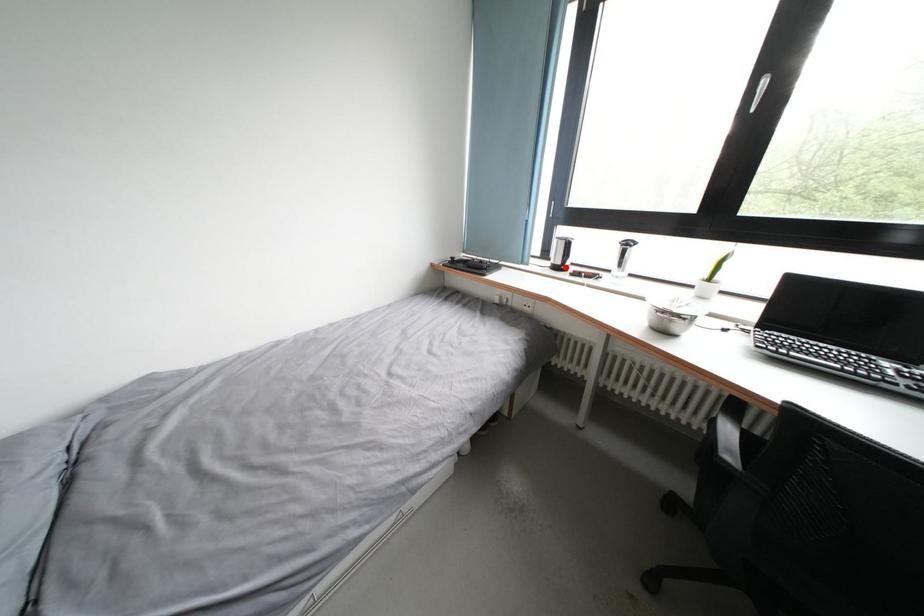
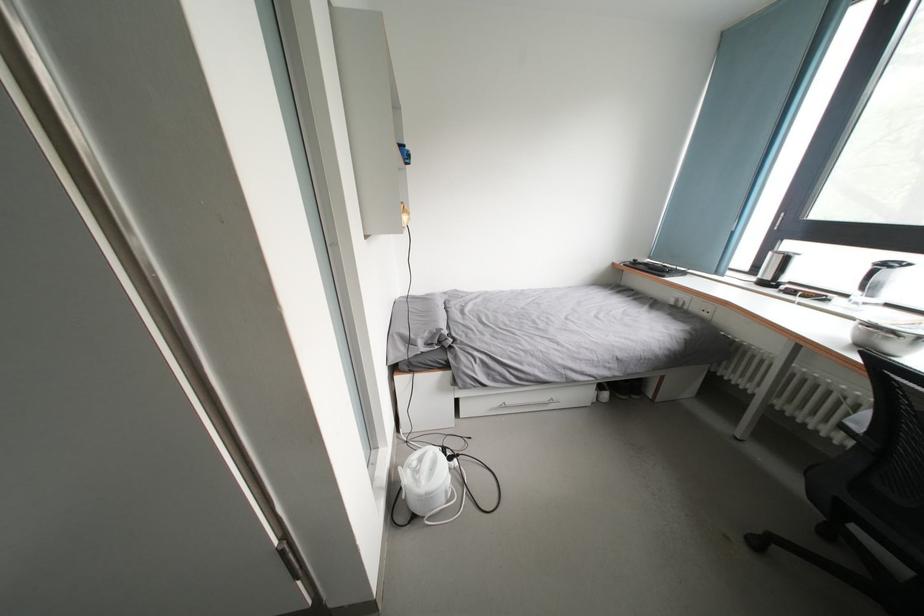
The point at the highlighted location is marked in the first image. Where is the corresponding point in the second image?

(774, 283)